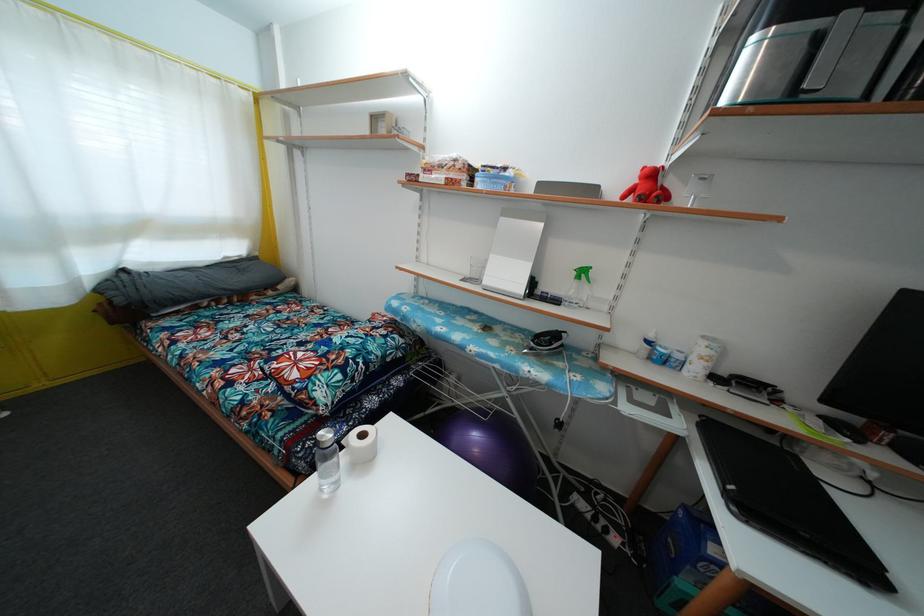
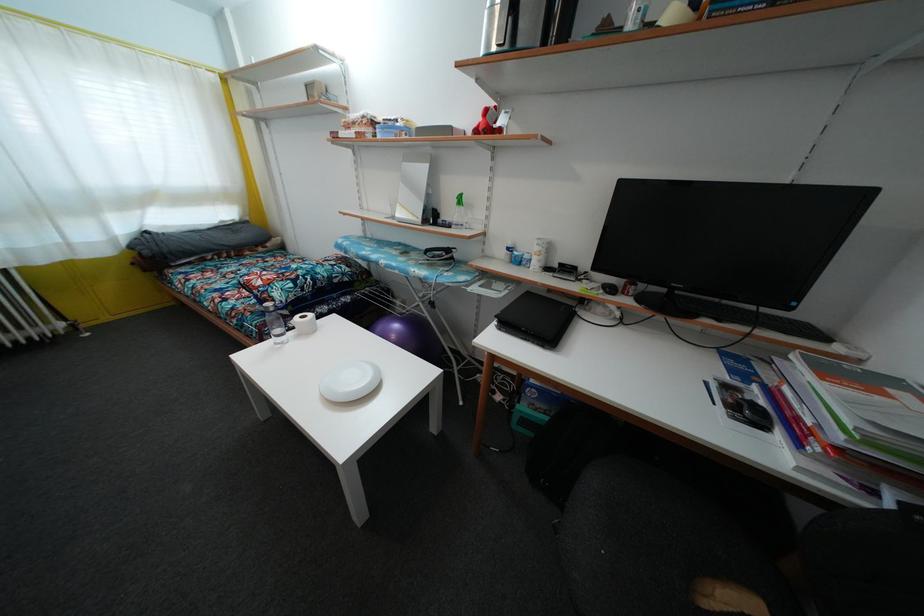
Find the pixel in the second image that matches the point at 483,403 in the first image.

(411, 315)